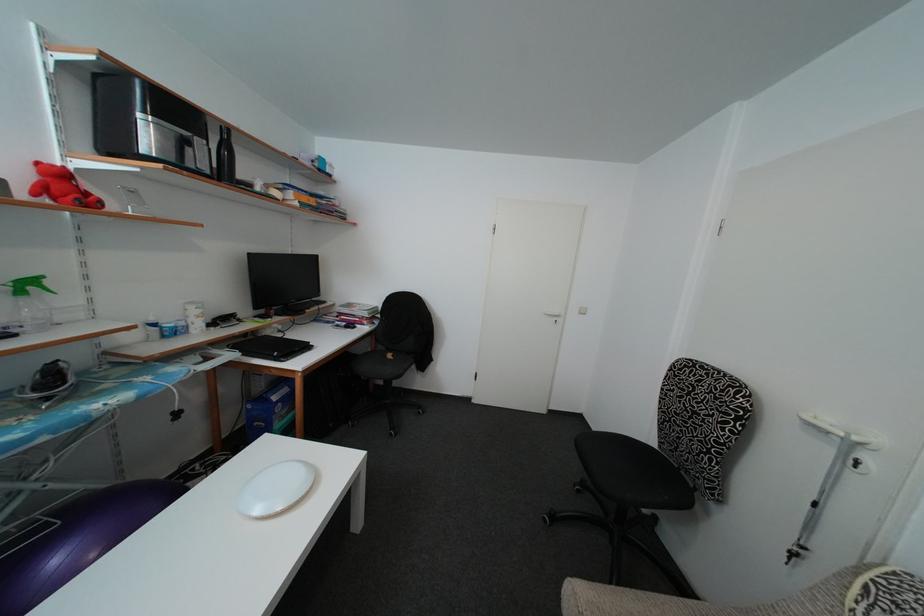
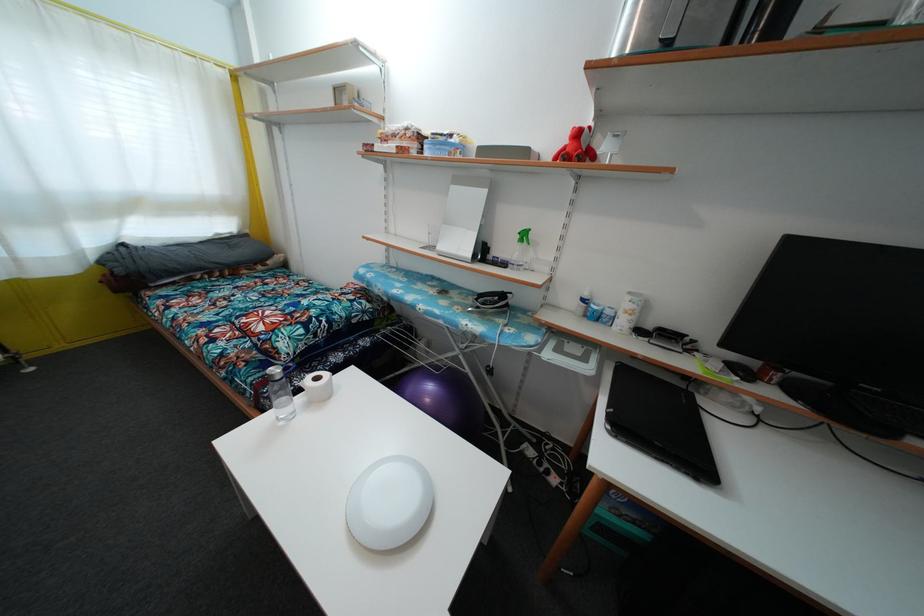
Find the pixel in the second image that matches pixel 31 293 in the first image.

(528, 241)